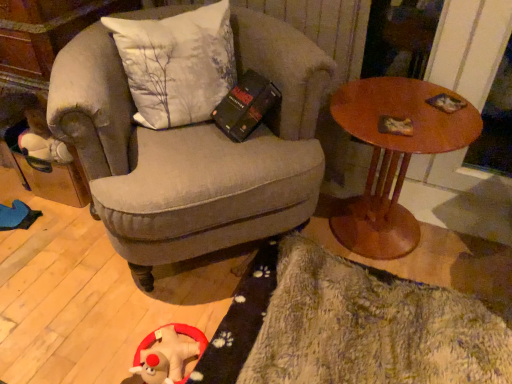
Identify the location of vacant space positioned to the left of fuzzy plush toy at lower left. (99, 354).